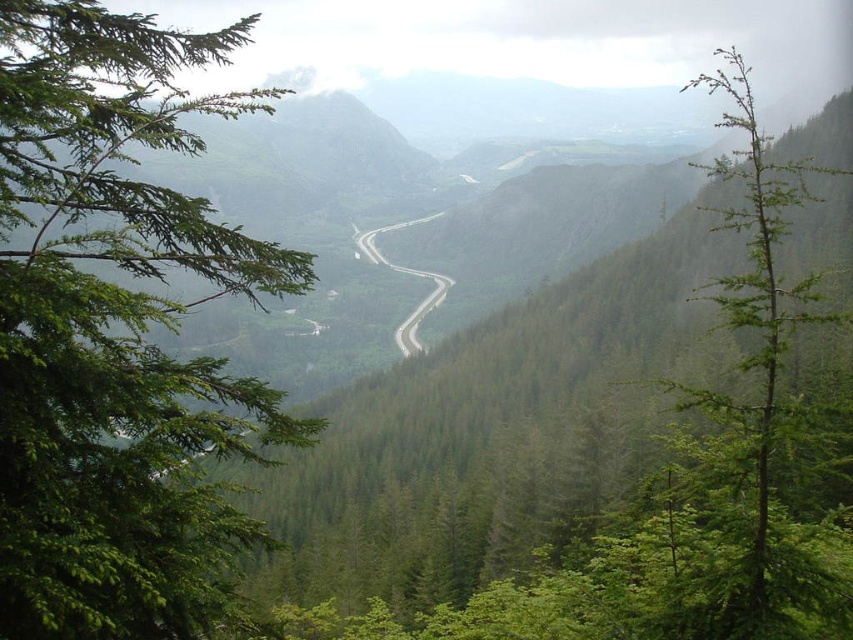
You are standing at the point with coordinates point (437,292) and want to reach the point with coordinates point (761,307). Which direction should you move to get closer to your destination?

You should move forward because point (761,307) is in front of point (437,292).

You are a hiker standing at the green leafy tree at left and want to reach the green asphalt road at center. The road is 2 meters wide. Can you walk directly towards the road without crossing any other paths or obstacles?

The green leafy tree at left is 66.17 meters away from the green asphalt road at center. Since there are no other paths or obstacles mentioned in the scene description, you can walk directly towards the road.